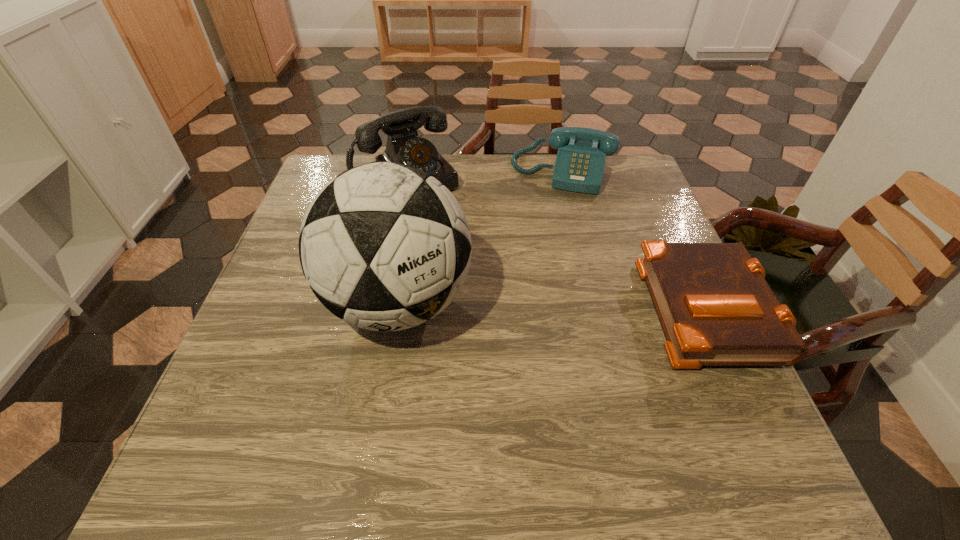
Identify the location of free spot on the desktop that is between the tallest object and the shortest object and is positioned on the dial of the third tallest object. (534, 305).

Locate an element on the screen. The height and width of the screenshot is (540, 960). free space on the desktop that is between the soccer ball and the shortest object and is positioned on the dial of the left telephone is located at coordinates (512, 304).